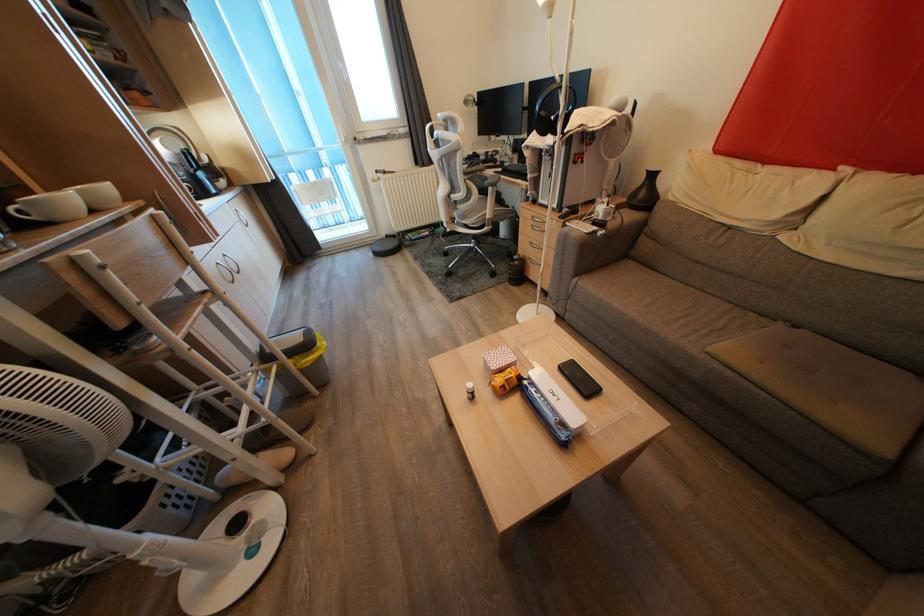
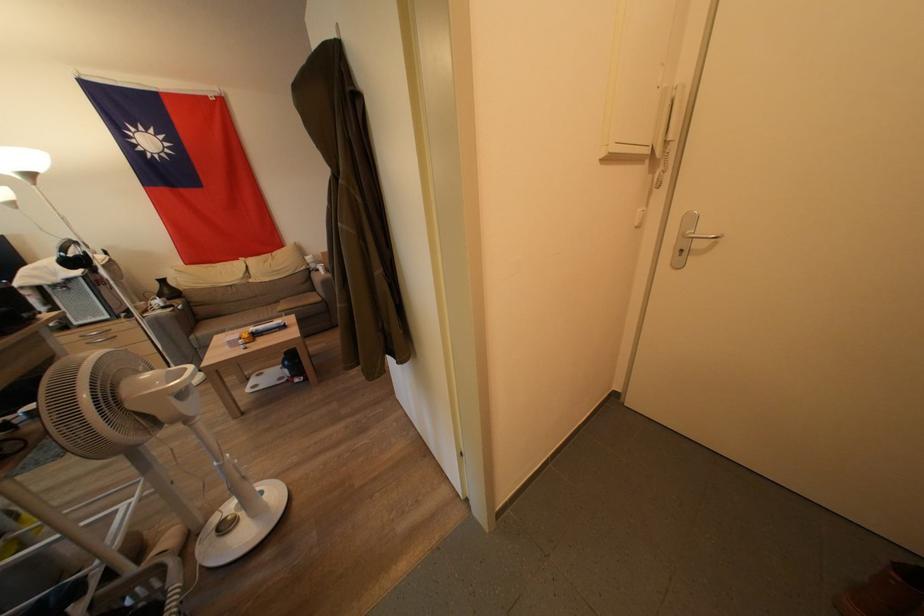
The point at [647,199] is marked in the first image. Where is the corresponding point in the second image?

(172, 296)